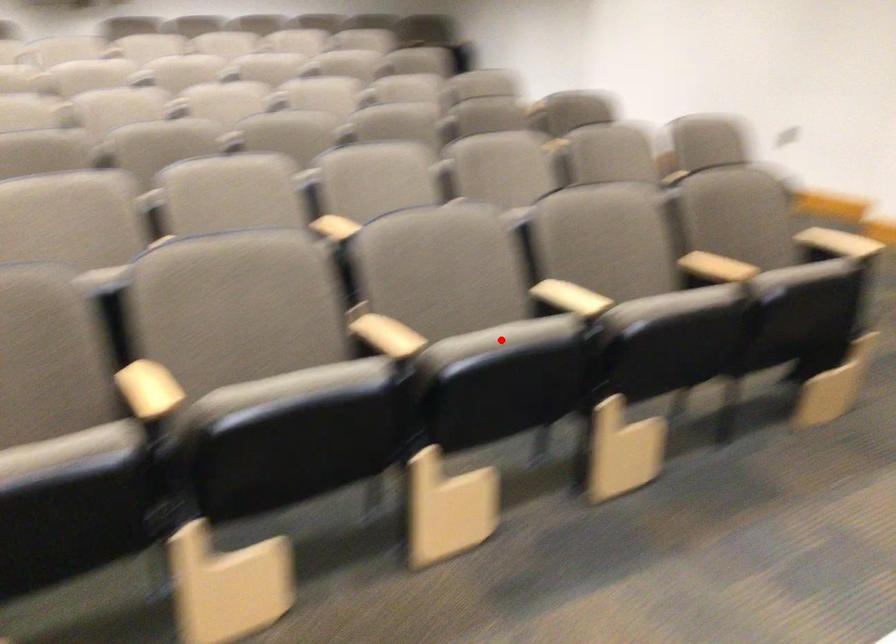
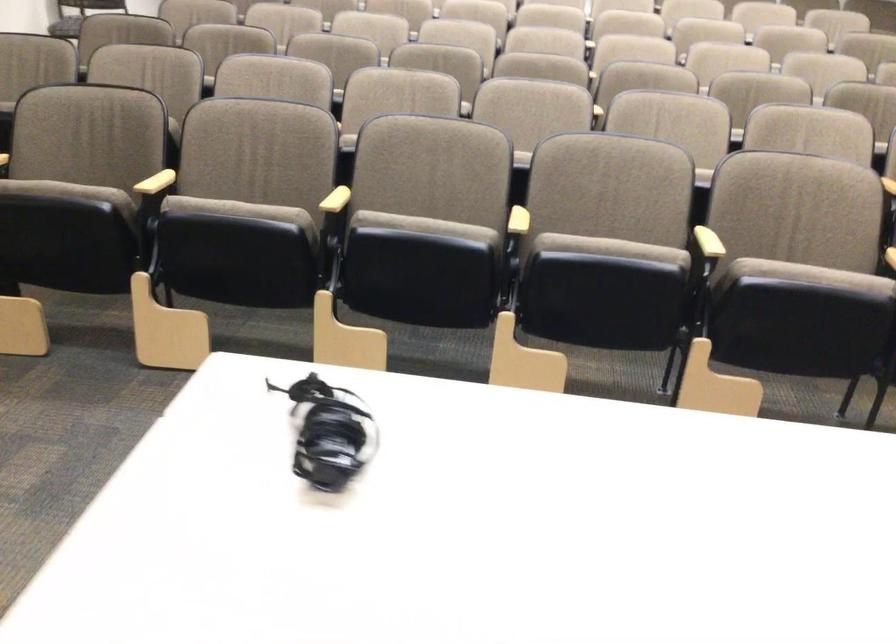
Find the pixel in the second image that matches the highlighted location in the first image.

(610, 249)